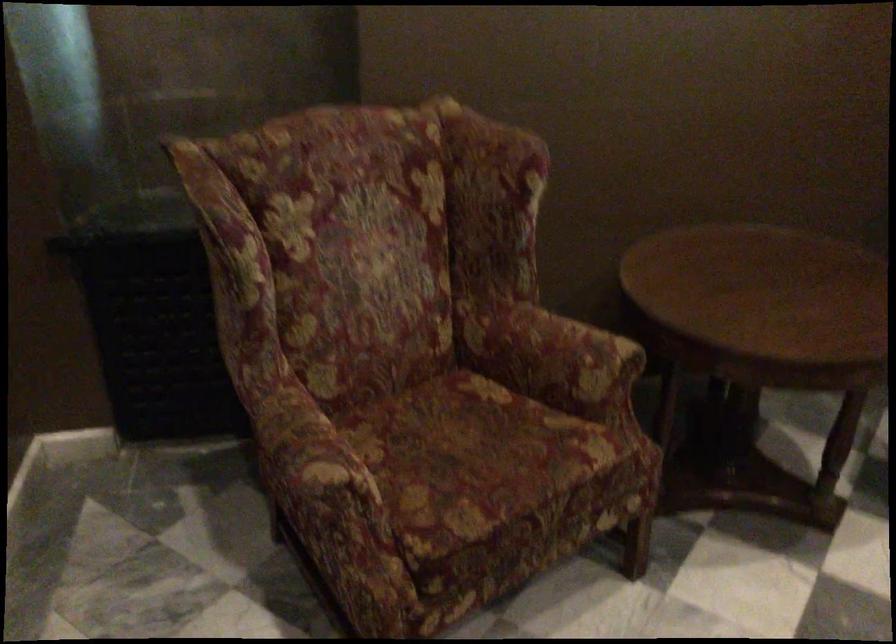
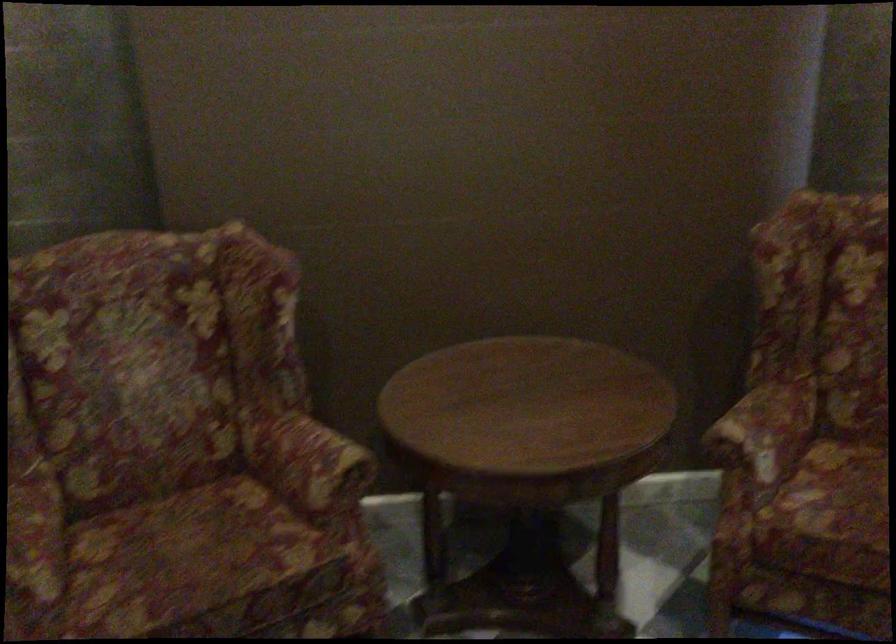
Question: The images are taken continuously from a first-person perspective. In which direction are you moving?

Choices:
 (A) Left
 (B) Right
 (C) Forward
 (D) Backward

Answer: (B)